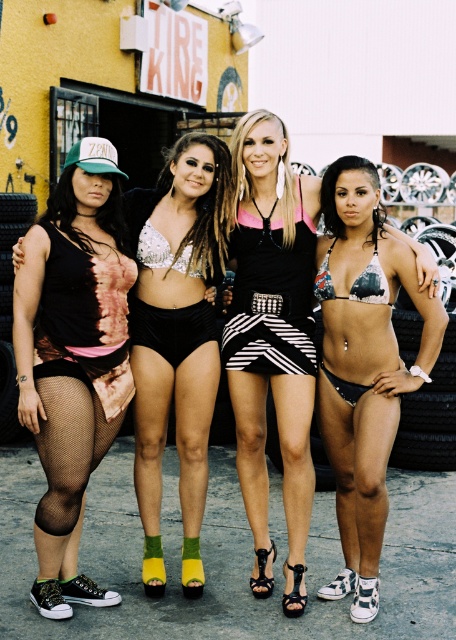
Question: Which of these objects is positioned closest to the black velvet underwear at center?

Choices:
 (A) matte black shorts at center
 (B) fishnet stockings at lower left
 (C) printed bikini top at center

Answer: (A)

Question: Which object appears farthest from the camera in this image?

Choices:
 (A) fishnet stockings at lower left
 (B) printed bikini top at center

Answer: (B)

Question: Is printed bikini top at center bigger than black velvet underwear at center?

Choices:
 (A) no
 (B) yes

Answer: (B)

Question: Does printed bikini top at center appear on the right side of matte black shorts at center?

Choices:
 (A) yes
 (B) no

Answer: (A)

Question: Among these objects, which one is nearest to the camera?

Choices:
 (A) fishnet stockings at lower left
 (B) matte black shorts at center
 (C) printed bikini top at center
 (D) black velvet underwear at center

Answer: (A)

Question: Is matte black shorts at center to the right of fishnet stockings at lower left from the viewer's perspective?

Choices:
 (A) no
 (B) yes

Answer: (B)